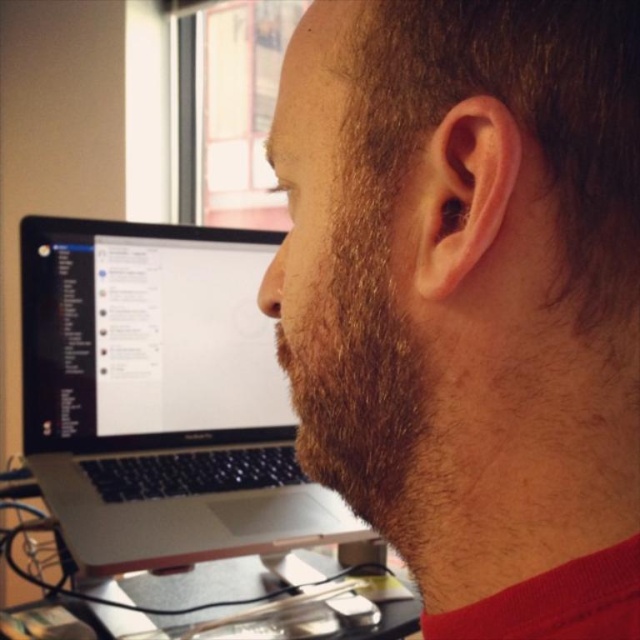
Who is positioned more to the right, silver metallic laptop at left or metallic silver computer desk at lower center?

From the viewer's perspective, silver metallic laptop at left appears more on the right side.

Is point (216, 289) farther from camera compared to point (45, 588)?

Yes, it is behind point (45, 588).

Where is `silver metallic laptop at left`? The width and height of the screenshot is (640, 640). silver metallic laptop at left is located at coordinates (x=161, y=396).

Which is above, dark brown beard at center or silver metallic laptop at left?

dark brown beard at center is above.

Is point (432, 444) less distant than point (205, 321)?

Yes, point (432, 444) is in front of point (205, 321).

Identify the location of dark brown beard at center. (470, 298).

Which is above, dark brown beard at center or metallic silver computer desk at lower center?

Positioned higher is dark brown beard at center.

Is point (616, 566) farther from viewer compared to point (214, 605)?

No, it is in front of (214, 605).

This screenshot has width=640, height=640. What do you see at coordinates (470, 298) in the screenshot?
I see `dark brown beard at center` at bounding box center [470, 298].

I want to click on dark brown beard at center, so click(470, 298).